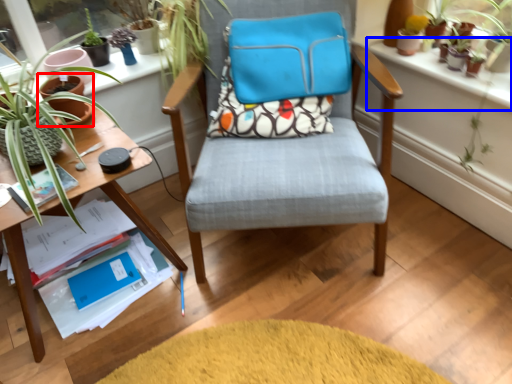
Question: Which object is further to the camera taking this photo, flowerpot (highlighted by a red box) or window sill (highlighted by a blue box)?

Choices:
 (A) flowerpot
 (B) window sill

Answer: (A)